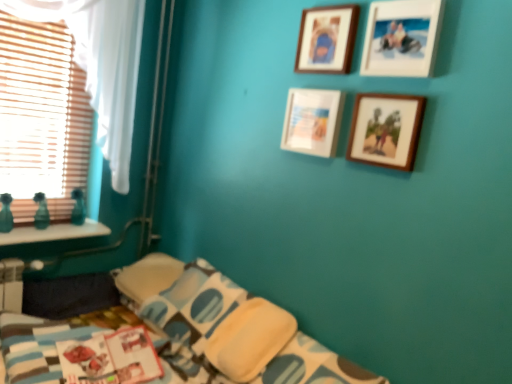
Question: Which direction should I rotate to face wooden picture frame at upper center, which is counted as the fourth picture frame, starting from the bottom, — up or down?

Choices:
 (A) down
 (B) up

Answer: (B)

Question: Is wooden picture frame at upper center, which is the first picture frame from top to bottom, to the right of yellow soft pillow at lower right from the viewer's perspective?

Choices:
 (A) yes
 (B) no

Answer: (A)

Question: Does wooden picture frame at upper center, which is counted as the fourth picture frame, starting from the bottom, have a larger size compared to yellow soft pillow at lower right?

Choices:
 (A) no
 (B) yes

Answer: (A)

Question: Is yellow soft pillow at lower right at the back of wooden picture frame at upper center, which is the first picture frame from top to bottom?

Choices:
 (A) no
 (B) yes

Answer: (A)

Question: Does wooden picture frame at upper center, which is the first picture frame from top to bottom, have a lesser height compared to yellow soft pillow at lower right?

Choices:
 (A) no
 (B) yes

Answer: (B)

Question: Does wooden picture frame at upper center, which is the first picture frame from top to bottom, have a greater width compared to yellow soft pillow at lower right?

Choices:
 (A) yes
 (B) no

Answer: (B)

Question: Could you tell me if wooden picture frame at upper center, which is the first picture frame from top to bottom, is turned towards yellow soft pillow at lower right?

Choices:
 (A) no
 (B) yes

Answer: (A)

Question: Does wooden photo frame at upper right, which ranks as the 4th picture frame in top-to-bottom order, have a lesser height compared to yellow soft pillow at lower right?

Choices:
 (A) yes
 (B) no

Answer: (A)

Question: From the image's perspective, is wooden photo frame at upper right, which ranks as the 4th picture frame in top-to-bottom order, located beneath yellow soft pillow at lower right?

Choices:
 (A) yes
 (B) no

Answer: (B)

Question: From a real-world perspective, is wooden photo frame at upper right, the 1th picture frame positioned from the bottom, located beneath yellow soft pillow at lower right?

Choices:
 (A) yes
 (B) no

Answer: (B)

Question: From the image's perspective, is wooden photo frame at upper right, the 1th picture frame positioned from the bottom, above yellow soft pillow at lower right?

Choices:
 (A) no
 (B) yes

Answer: (B)

Question: Is wooden photo frame at upper right, the 1th picture frame positioned from the bottom, at the right side of yellow soft pillow at lower right?

Choices:
 (A) yes
 (B) no

Answer: (A)

Question: Is wooden photo frame at upper right, the 1th picture frame positioned from the bottom, positioned behind yellow soft pillow at lower right?

Choices:
 (A) no
 (B) yes

Answer: (A)

Question: Does wooden photo frame at upper right, which ranks as the 4th picture frame in top-to-bottom order, have a smaller size compared to wooden photo frame at upper right, which is counted as the third picture frame, starting from the bottom?

Choices:
 (A) yes
 (B) no

Answer: (A)